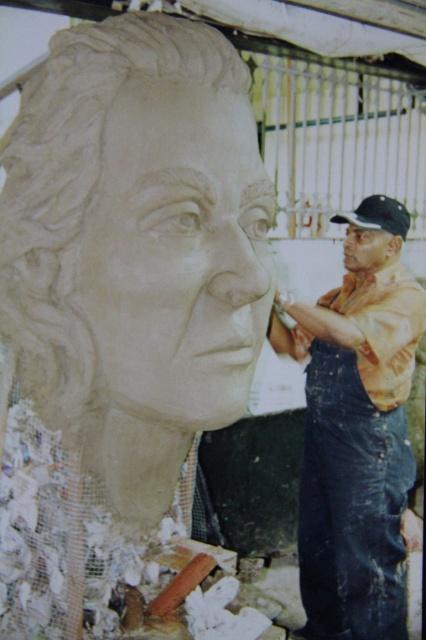
You are a sculptor who needs to reach the matte clay face at right without touching the denim overalls at right. Can you extend your hand 18 inches to grab it?

The denim overalls at right is 17.46 inches from matte clay face at right. Since your hand can extend 18 inches, you can reach the matte clay face at right without touching the denim overalls at right.

You are an art student observing the sculptor and their workspace. You notice the white clay sculpture at center and the matte clay face at right. Which object has a greater width according to the description?

The white clay sculpture at center has a greater width than the matte clay face at right.

You are an art student observing the sculptor in the studio. You notice the white clay sculpture at center and the matte clay face at right. Which object is taller?

The white clay sculpture at center is taller than the matte clay face at right.